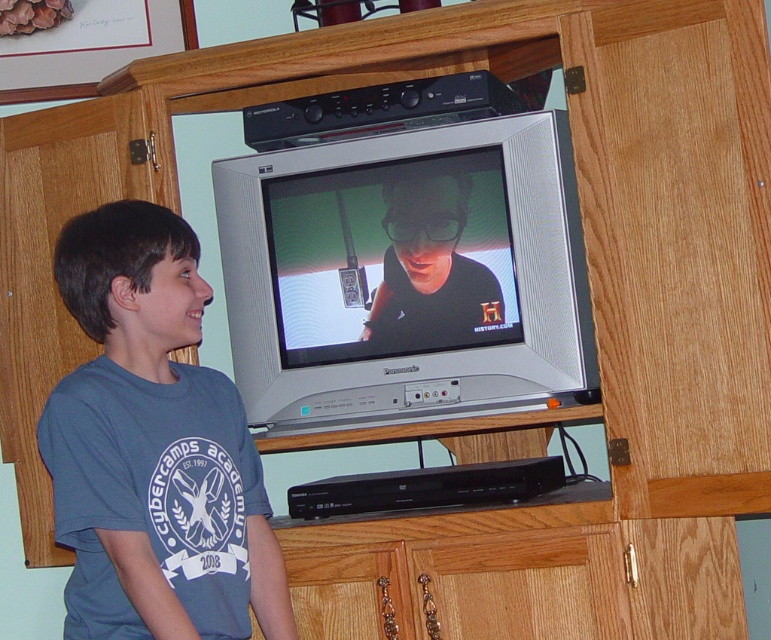
Question: Among these points, which one is farthest from the camera?

Choices:
 (A) (187, 490)
 (B) (443, 144)

Answer: (B)

Question: Which of the following is the farthest from the observer?

Choices:
 (A) blue cotton shirt at center
 (B) silver metallic television at center

Answer: (B)

Question: Does silver metallic television at center have a smaller size compared to blue cotton shirt at center?

Choices:
 (A) yes
 (B) no

Answer: (A)

Question: Does silver metallic television at center lie behind blue cotton shirt at center?

Choices:
 (A) no
 (B) yes

Answer: (B)

Question: Can you confirm if silver metallic television at center is bigger than blue cotton shirt at center?

Choices:
 (A) no
 (B) yes

Answer: (A)

Question: Which of the following is the closest to the observer?

Choices:
 (A) (428, 340)
 (B) (167, 352)

Answer: (B)